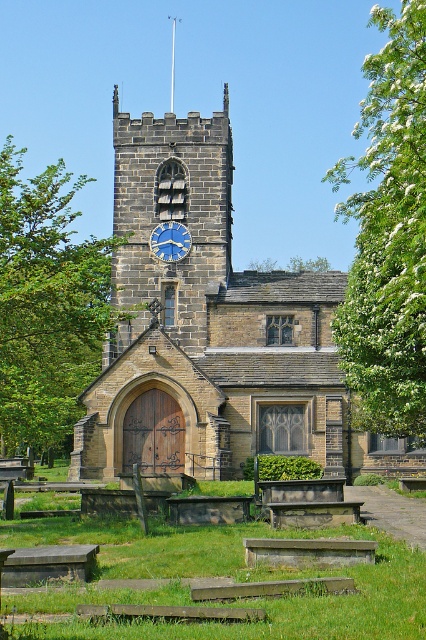
Question: Estimate the real-world distances between objects in this image. Which object is farther from the brown stone church at center?

Choices:
 (A) blue painted stone clock at upper center
 (B) white blossoming tree at upper right
 (C) green leafy tree at left
 (D) smooth stone spire at center top

Answer: (D)

Question: Estimate the real-world distances between objects in this image. Which object is closer to the brown stone church at center?

Choices:
 (A) blue painted stone clock at upper center
 (B) green leafy tree at left
 (C) smooth stone spire at center top

Answer: (B)

Question: Does blue painted stone clock at upper center have a greater width compared to smooth stone spire at center top?

Choices:
 (A) yes
 (B) no

Answer: (A)

Question: Which object is farther from the camera taking this photo?

Choices:
 (A) white blossoming tree at upper right
 (B) blue painted stone clock at upper center
 (C) green leafy tree at left

Answer: (B)

Question: From the image, what is the correct spatial relationship of green leafy tree at left in relation to blue painted stone clock at upper center?

Choices:
 (A) left
 (B) right

Answer: (A)

Question: Is blue painted stone clock at upper center wider than smooth stone spire at center top?

Choices:
 (A) no
 (B) yes

Answer: (B)